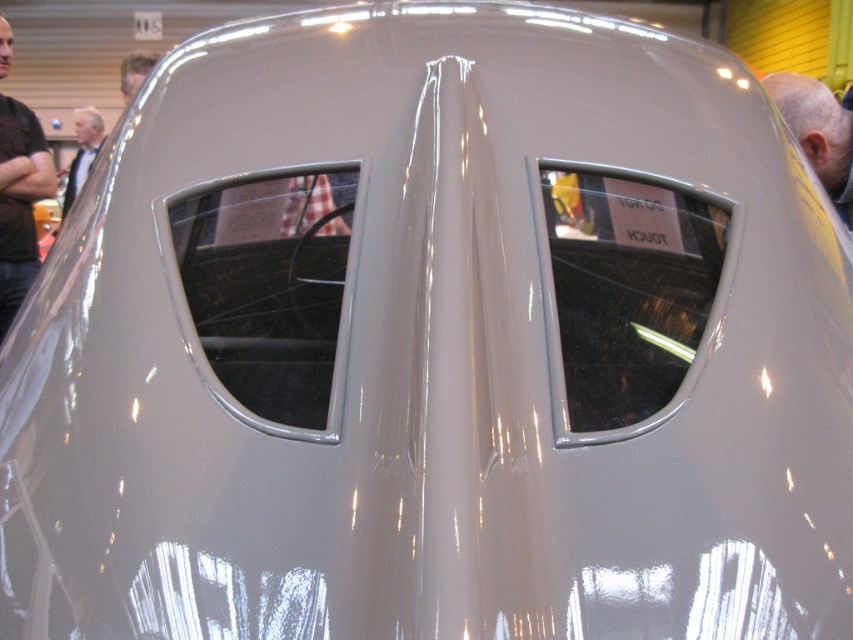
Is dark brown leather shirt at left bigger than light brown hair at upper left?

Indeed, dark brown leather shirt at left has a larger size compared to light brown hair at upper left.

Which is behind, point (27, 275) or point (142, 54)?

Point (142, 54)

In the scene shown: Who is more forward, (4, 20) or (125, 77)?

Point (4, 20) is in front.

Locate an element on the screen. This screenshot has height=640, width=853. dark brown leather shirt at left is located at coordinates (19, 202).

Can you confirm if dark brown leather shirt at left is shorter than gray matte head at upper right?

No.

Who is lower down, dark brown leather shirt at left or gray matte head at upper right?

dark brown leather shirt at left is below.

What do you see at coordinates (19, 202) in the screenshot? I see `dark brown leather shirt at left` at bounding box center [19, 202].

At what (x,y) coordinates should I click in order to perform the action: click on dark brown leather shirt at left. Please return your answer as a coordinate pair (x, y). Looking at the image, I should click on 19,202.

Can you confirm if gray matte head at upper right is wider than light brown hair at upper left?

Yes, gray matte head at upper right is wider than light brown hair at upper left.

Where is `gray matte head at upper right`? Image resolution: width=853 pixels, height=640 pixels. gray matte head at upper right is located at coordinates (817, 132).

This screenshot has height=640, width=853. Identify the location of gray matte head at upper right. (817, 132).